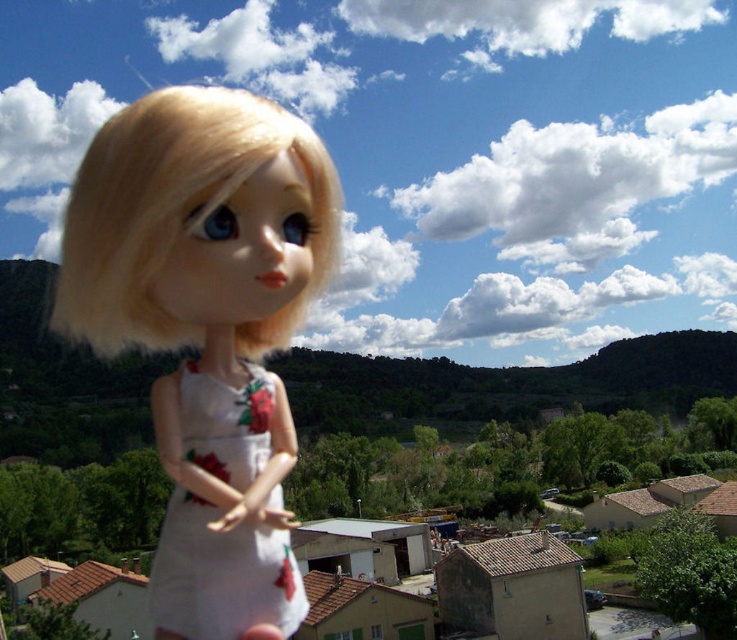
Question: Is satin white doll at center behind white matte dress at left?

Choices:
 (A) no
 (B) yes

Answer: (A)

Question: Which point appears closest to the camera in this image?

Choices:
 (A) (279, 556)
 (B) (220, 467)

Answer: (B)

Question: Does satin white doll at center have a larger size compared to white matte dress at left?

Choices:
 (A) yes
 (B) no

Answer: (A)

Question: Among these points, which one is nearest to the camera?

Choices:
 (A) (x=268, y=486)
 (B) (x=241, y=492)

Answer: (B)

Question: Does satin white doll at center have a lesser width compared to white matte dress at left?

Choices:
 (A) no
 (B) yes

Answer: (A)